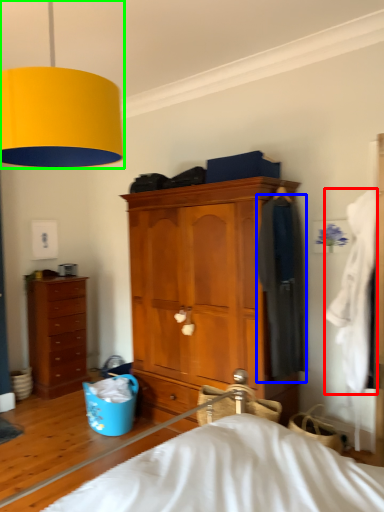
Question: Which object is positioned closest to clothing (highlighted by a red box)? Select from clothing (highlighted by a blue box) and lamp (highlighted by a green box).

Choices:
 (A) clothing
 (B) lamp

Answer: (A)